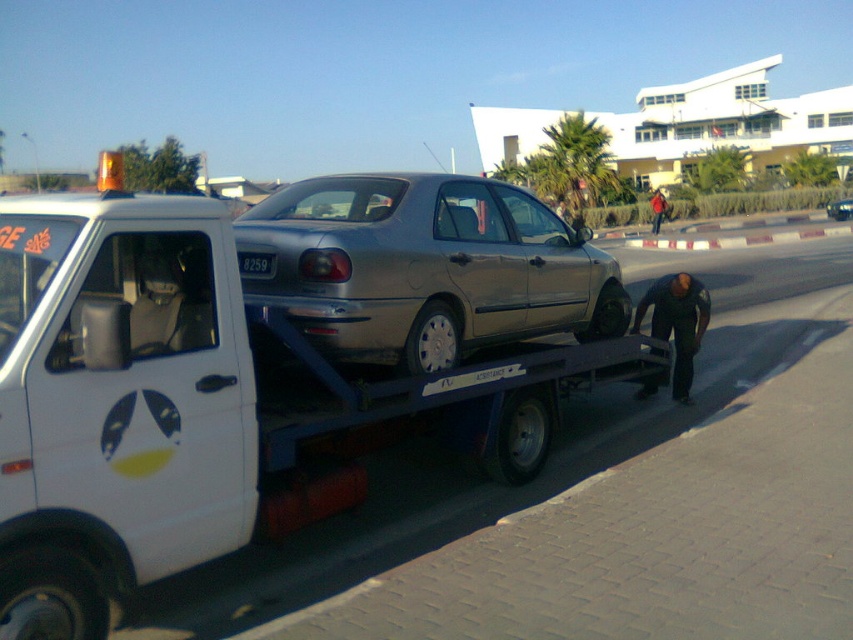
Does satin silver car at center appear under black plastic license plate at center?

Actually, satin silver car at center is above black plastic license plate at center.

Between satin silver car at center and black plastic license plate at center, which one has less height?

black plastic license plate at center

Where is `satin silver car at center`? satin silver car at center is located at coordinates (426, 268).

Between white matte tow truck at center and black plastic license plate at center, which one has more height?

With more height is white matte tow truck at center.

Is point (306, 433) positioned before point (252, 266)?

Yes.

At what (x,y) coordinates should I click in order to perform the action: click on white matte tow truck at center. Please return your answer as a coordinate pair (x, y). Image resolution: width=853 pixels, height=640 pixels. Looking at the image, I should click on (196, 403).

Is dark brown leather jacket at lower right to the right of black plastic license plate at center from the viewer's perspective?

Correct, you'll find dark brown leather jacket at lower right to the right of black plastic license plate at center.

Does point (670, 296) lie behind point (253, 269)?

Yes, point (670, 296) is farther from viewer.

Find the location of `dark brown leather jacket at lower right`. dark brown leather jacket at lower right is located at coordinates (677, 323).